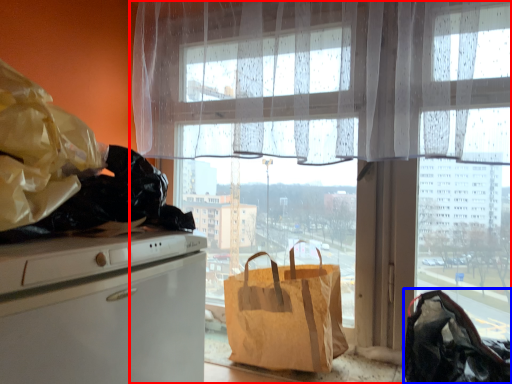
Question: Which of the following is the farthest to the observer, window (highlighted by a red box) or handbag (highlighted by a blue box)?

Choices:
 (A) window
 (B) handbag

Answer: (A)